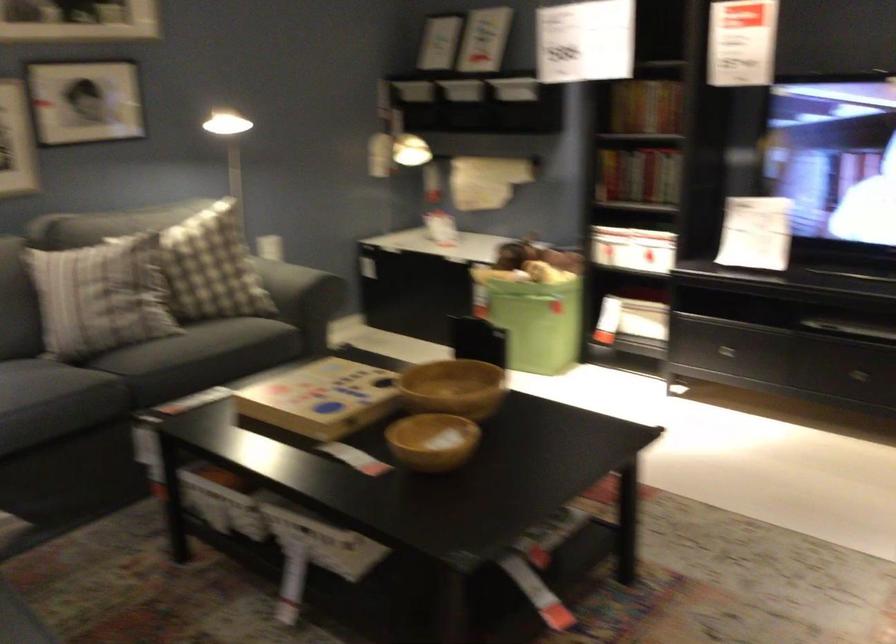
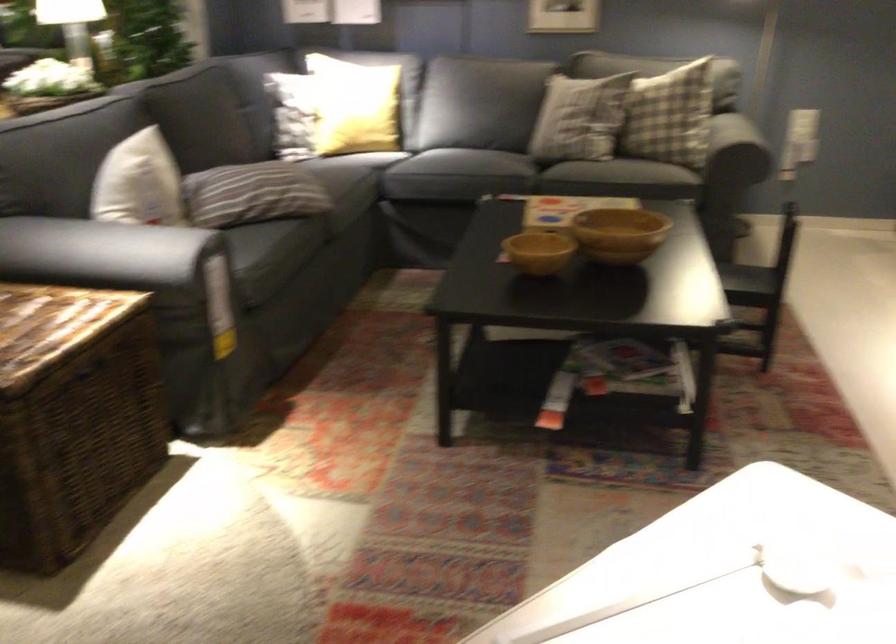
Find the pixel in the second image that matches (x=270, y=272) in the first image.

(668, 115)